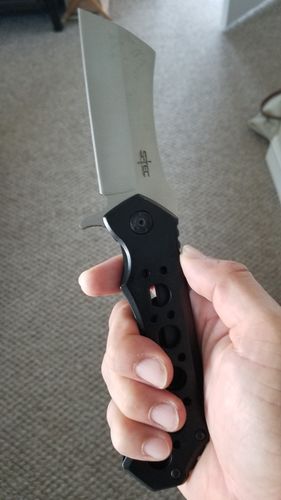
Image resolution: width=281 pixels, height=500 pixels. Find the location of `handle`. handle is located at coordinates (184, 329).